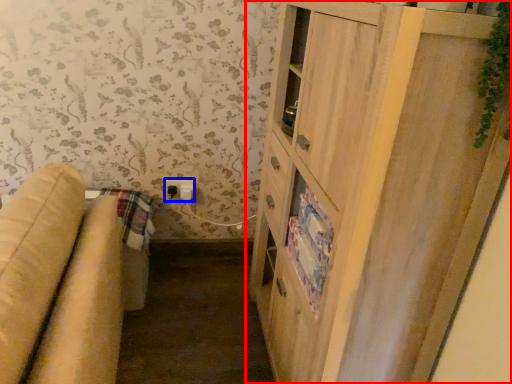
Question: Among these objects, which one is nearest to the camera, cupboard (highlighted by a red box) or electric outlet (highlighted by a blue box)?

Choices:
 (A) cupboard
 (B) electric outlet

Answer: (A)